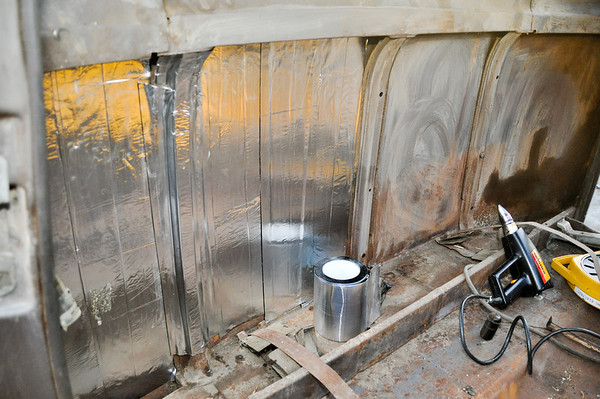
Locate an element on the screen. This screenshot has width=600, height=399. rust floor is located at coordinates (418, 355).